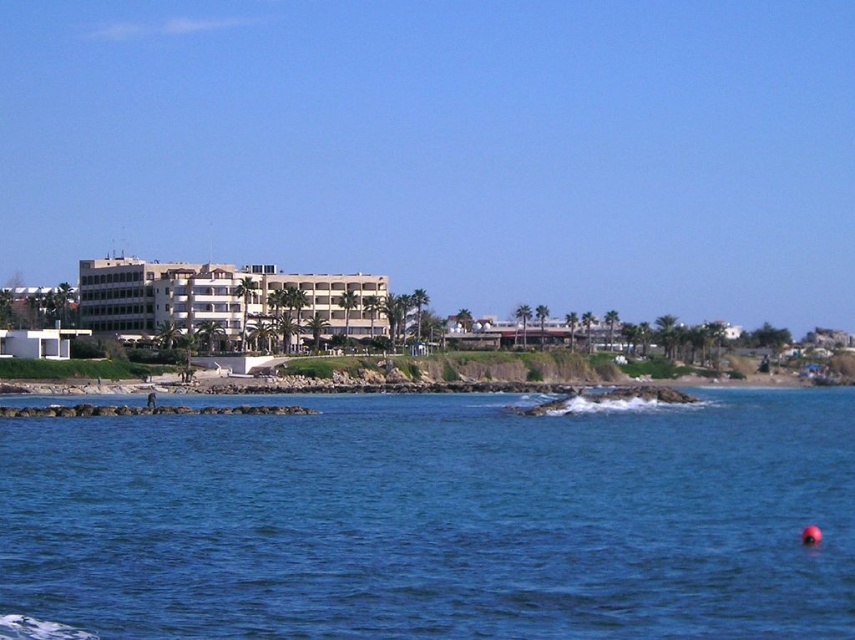
Which is behind, point (684, 515) or point (317, 292)?

The point (317, 292) is more distant.

Does blue water at center have a larger size compared to white matte building at center?

No, blue water at center is not bigger than white matte building at center.

Describe the element at coordinates (435, 520) in the screenshot. I see `blue water at center` at that location.

Find the location of a particular element. This screenshot has width=855, height=640. blue water at center is located at coordinates (435, 520).